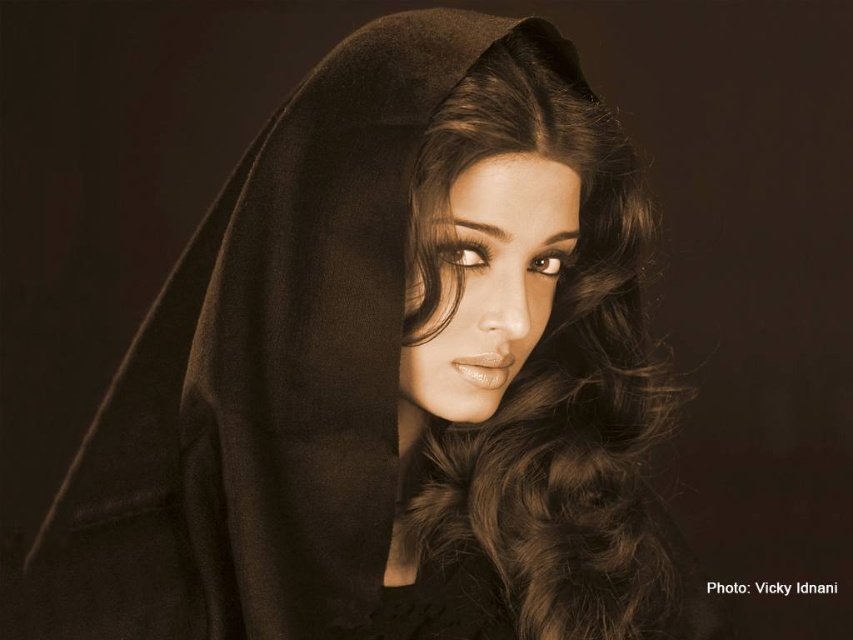
Question: Can you confirm if brown silky hair at center is positioned to the right of smooth skin face at center?

Choices:
 (A) no
 (B) yes

Answer: (B)

Question: Which of the following is the closest to the observer?

Choices:
 (A) (485, 604)
 (B) (480, 280)

Answer: (B)

Question: Which object is closer to the camera taking this photo?

Choices:
 (A) brown silky hair at center
 (B) smooth skin face at center

Answer: (A)

Question: Does brown silky hair at center appear under smooth skin face at center?

Choices:
 (A) no
 (B) yes

Answer: (B)

Question: Does brown silky hair at center have a lesser width compared to smooth skin face at center?

Choices:
 (A) no
 (B) yes

Answer: (A)